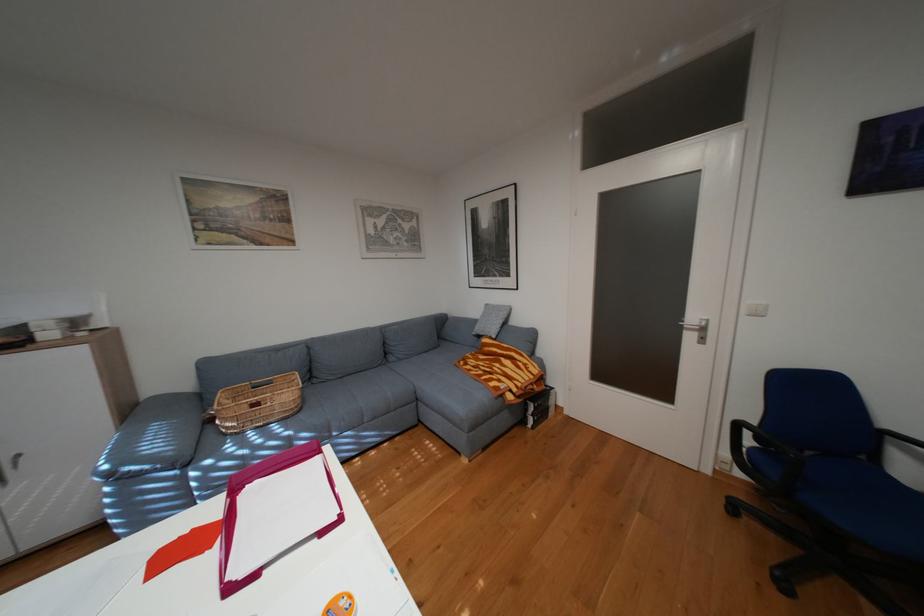
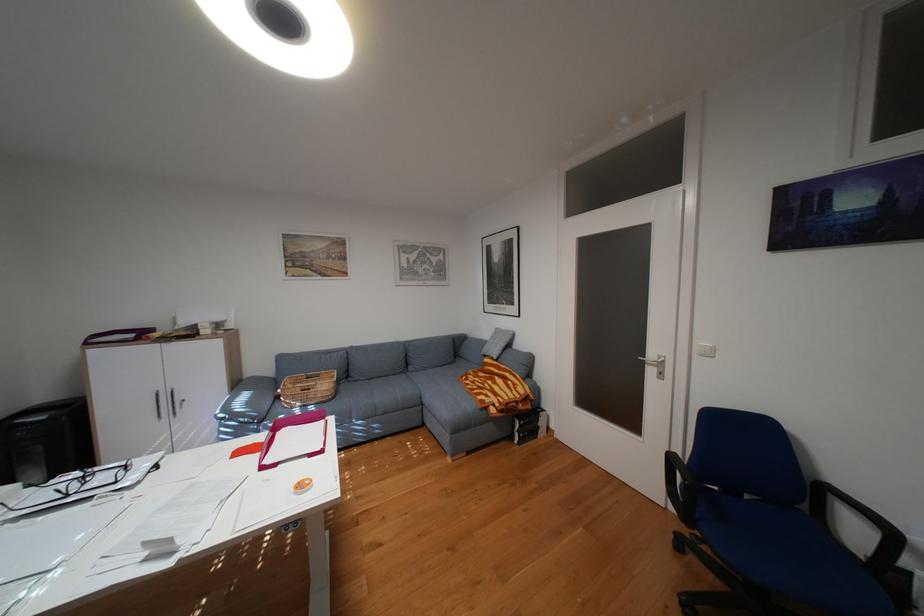
Find the pixel in the second image that matches pixel 877 456 in the first image.

(817, 508)